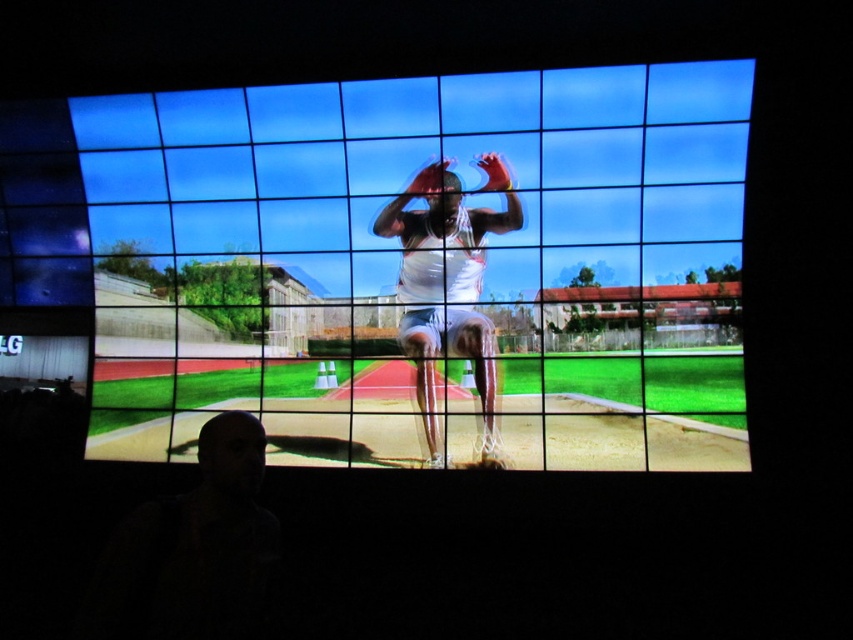
Consider the image. Between smooth white track at center and white matte athletic uniform at center, which one is positioned higher?

smooth white track at center is higher up.

Is smooth white track at center thinner than white matte athletic uniform at center?

Incorrect, smooth white track at center's width is not less than white matte athletic uniform at center's.

Who is more forward, (618, 148) or (428, 296)?

Point (618, 148) is more forward.

You are a GUI agent. You are given a task and a screenshot of the screen. Output one action in this format:
    pyautogui.click(x=<x>, y=<y>)
    Task: Click on the smooth white track at center
    The height and width of the screenshot is (640, 853).
    Given the screenshot: What is the action you would take?
    pyautogui.click(x=422, y=268)